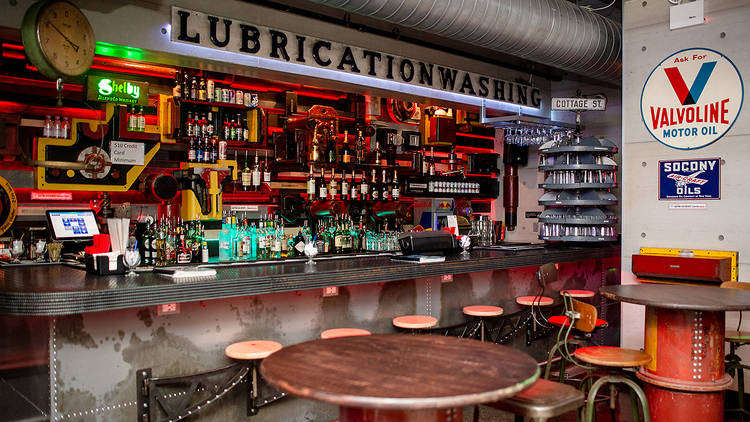
What are the coordinates of `tablet for register` in the screenshot? It's located at (67, 221).